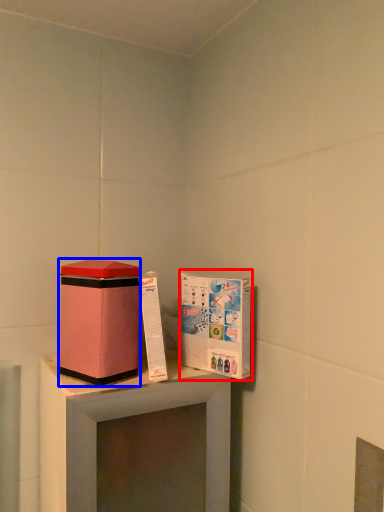
Question: Among these objects, which one is farthest to the camera, cardboard box (highlighted by a red box) or box (highlighted by a blue box)?

Choices:
 (A) cardboard box
 (B) box

Answer: (A)